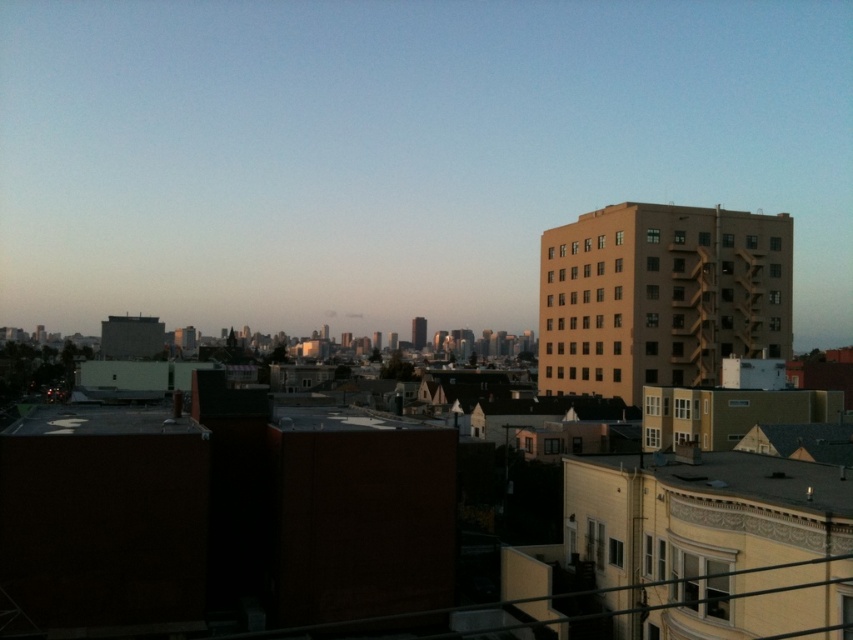
You are a city planner reviewing this area and need to determine if the matte brown building at right can block sunlight to the beige concrete building at upper right. Based on their heights, is this possible?

The matte brown building at right is taller than the beige concrete building at upper right, so it could potentially block sunlight to the beige concrete building at upper right if positioned appropriately.

You are an urban planner analyzing a city layout. You see the matte brown building at right in the image. What are the coordinates of its position?

The coordinates of the matte brown building at right are at point (398, 150).

You are a city planner reviewing this area. You need to install a new streetlight between the matte brown building at right and the beige concrete building at upper right. Considering their positions, which building should the streetlight be closer to?

The matte brown building at right is above the beige concrete building at upper right, so the streetlight should be closer to the beige concrete building at upper right since it is lower and the streetlight needs to be placed at a level accessible from the ground.